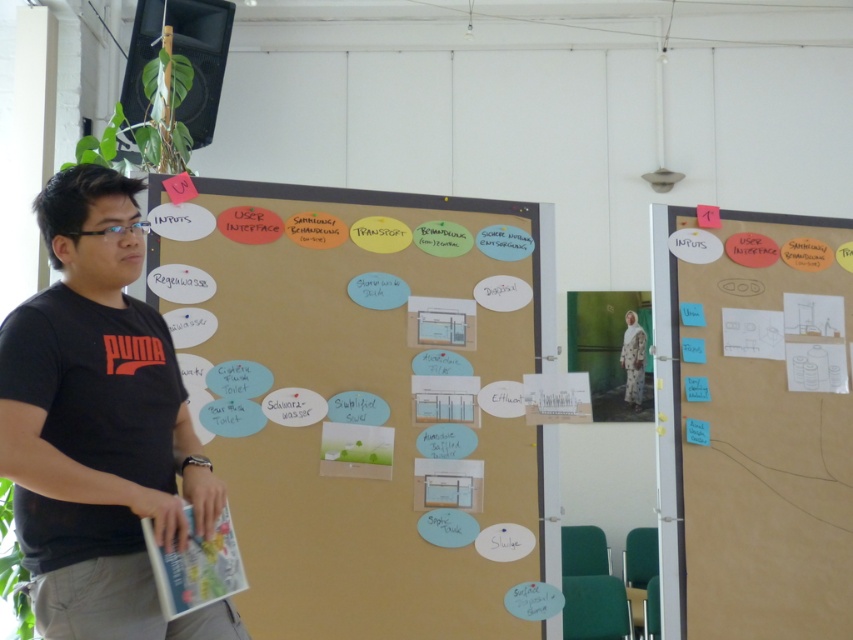
Which is in front, point (271, 380) or point (666, 621)?

Point (271, 380) is in front.

Between point (447, 328) and point (737, 296), which one is positioned behind?

Point (737, 296)

Which is in front, point (497, 504) or point (825, 612)?

Positioned in front is point (497, 504).

Locate an element on the screen. The height and width of the screenshot is (640, 853). brown paperboard at center is located at coordinates (361, 396).

Can you confirm if white paperboard at right is smaller than black cotton t-shirt at left?

Actually, white paperboard at right might be larger than black cotton t-shirt at left.

Which is in front, point (775, 401) or point (125, 531)?

Point (125, 531) is more forward.

Locate an element on the screen. white paperboard at right is located at coordinates (753, 422).

Can you confirm if brown paperboard at center is wider than black cotton t-shirt at left?

Yes, brown paperboard at center is wider than black cotton t-shirt at left.

Can you confirm if brown paperboard at center is smaller than black cotton t-shirt at left?

Incorrect, brown paperboard at center is not smaller in size than black cotton t-shirt at left.

Which is behind, point (346, 227) or point (76, 616)?

Point (346, 227)

Where is `brown paperboard at center`? The height and width of the screenshot is (640, 853). brown paperboard at center is located at coordinates (361, 396).